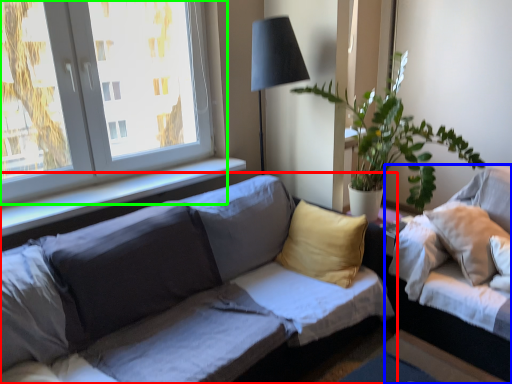
Question: Which object is the farthest from studio couch (highlighted by a red box)? Choose among these: studio couch (highlighted by a blue box) or window (highlighted by a green box).

Choices:
 (A) studio couch
 (B) window

Answer: (B)